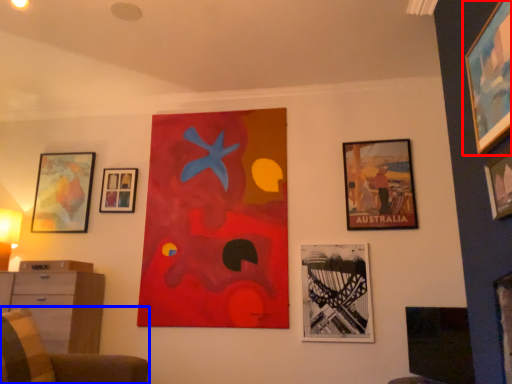
Question: Which object is further to the camera taking this photo, picture frame (highlighted by a red box) or furniture (highlighted by a blue box)?

Choices:
 (A) picture frame
 (B) furniture

Answer: (A)